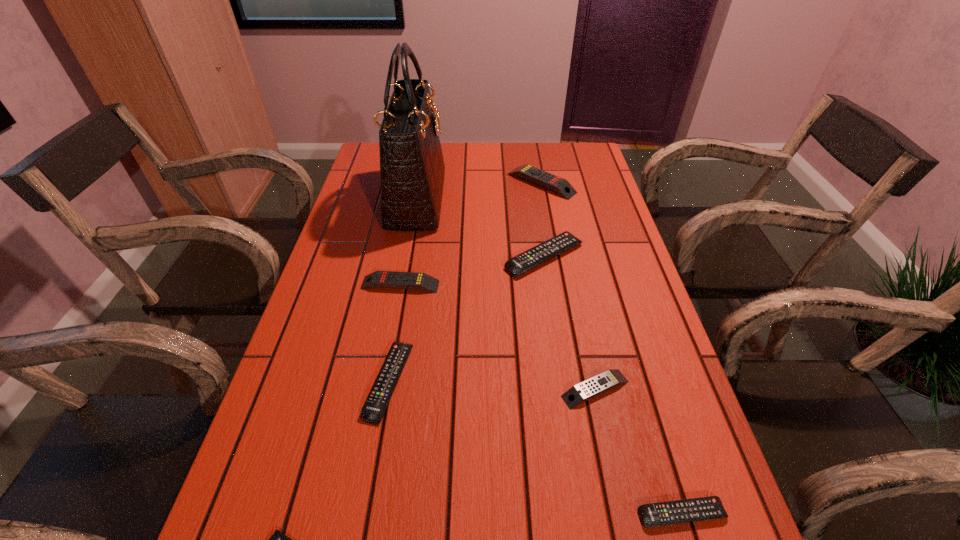
Where is `black remote control that stands as the second closest to the smallest yellow remote control`? Image resolution: width=960 pixels, height=540 pixels. black remote control that stands as the second closest to the smallest yellow remote control is located at coordinates (527, 260).

At what (x,y) coordinates should I click in order to perform the action: click on the second closest black remote control relative to the biggest black remote control. Please return your answer as a coordinate pair (x, y). Image resolution: width=960 pixels, height=540 pixels. Looking at the image, I should click on (705, 508).

The height and width of the screenshot is (540, 960). I want to click on free location that satisfies the following two spatial constraints: 1. on the back side of the farthest black remote control; 2. on the left side of the second farthest black remote control, so click(411, 256).

What are the coordinates of `free spot that satisfies the following two spatial constraints: 1. on the front side of the farthest black remote control; 2. on the left side of the smallest black remote control` in the screenshot? It's located at (585, 514).

Locate an element on the screen. The height and width of the screenshot is (540, 960). vacant space that satisfies the following two spatial constraints: 1. on the back side of the smallest yellow remote control; 2. at the front of the tallest object with visible charms is located at coordinates (555, 199).